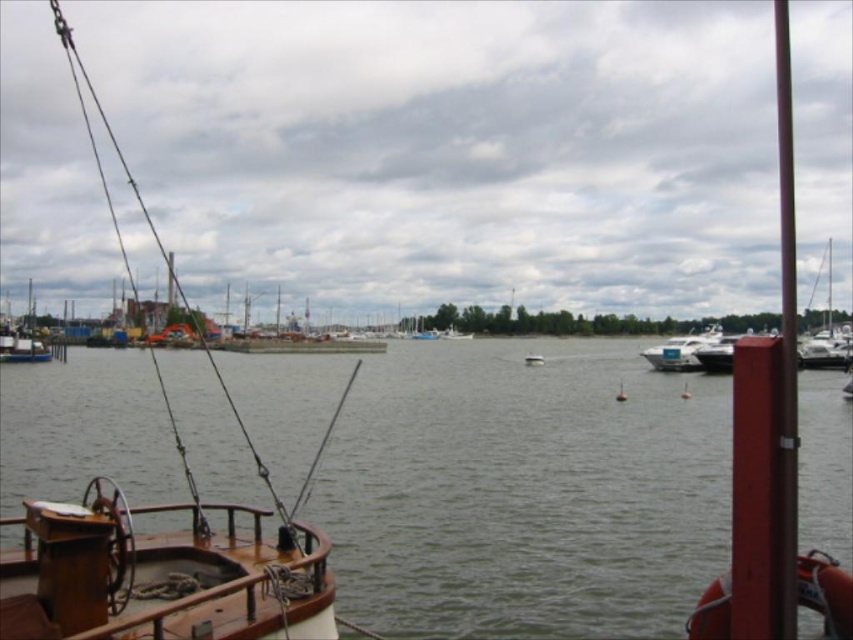
Question: Is the position of white glossy sailboat at right less distant than that of white plastic boat at center?

Choices:
 (A) no
 (B) yes

Answer: (B)

Question: Which object appears farthest from the camera in this image?

Choices:
 (A) white glossy sailboat at right
 (B) greenish water at center
 (C) white glossy boat at center
 (D) wooden sailboat at left

Answer: (C)

Question: Which object is the closest to the white glossy sailboat at right?

Choices:
 (A) wooden sailboat at left
 (B) white glossy motorboat at center-right
 (C) greenish water at center
 (D) white plastic boat at center

Answer: (B)

Question: Does white glossy motorboat at center-right lie in front of white glossy boat at center?

Choices:
 (A) no
 (B) yes

Answer: (B)

Question: Observing the image, what is the correct spatial positioning of white plastic boat at center in reference to white glossy boat at center?

Choices:
 (A) above
 (B) below

Answer: (A)

Question: Based on their relative distances, which object is farther from the white glossy sailboat at right?

Choices:
 (A) white glossy boat at center
 (B) white glossy motorboat at center-right
 (C) wooden sailboat at left

Answer: (C)